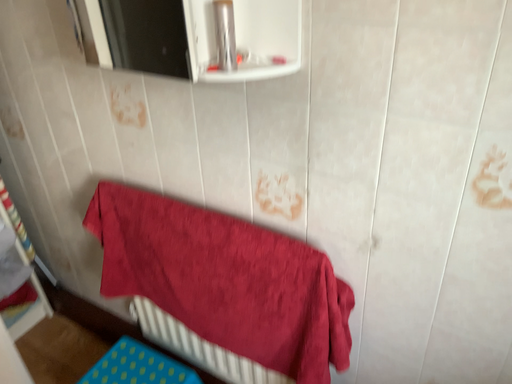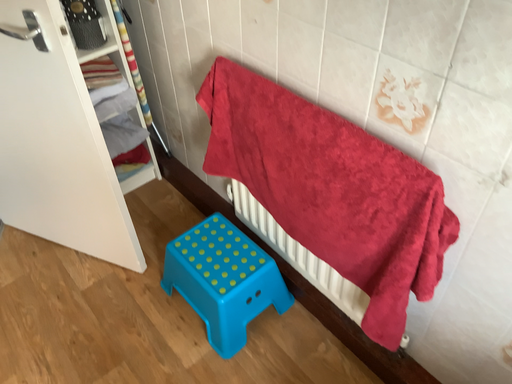
Question: Which way did the camera rotate in the video?

Choices:
 (A) rotated left
 (B) rotated right

Answer: (A)